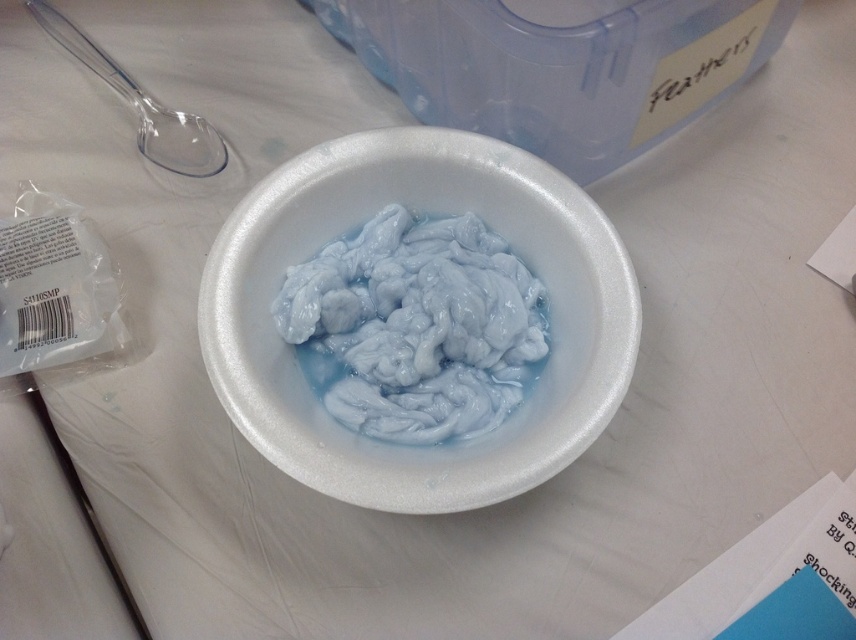
You are a scientist observing the white styrofoam bowl at center and the white rubbery substance at center. Which object is taller?

The white styrofoam bowl at center is much taller than the white rubbery substance at center.

You are a photographer standing at a distance of 1.2 meters from the camera position. You want to adjust your position so that you can see the point at coordinates point (376, 506) clearly. Should you move closer or farther away from the current camera position?

The point at coordinates point (376, 506) is currently 1.17 meters away from the camera. Since you are standing 1.2 meters away from the camera position, you should move closer to the camera by 0.03 meters to align with the point.

You are a scientist working in a lab and need to stir the contents of the white styrofoam bowl at center. The transparent plastic spoon at upper left is nearby. Can you reach the spoon without moving your current position?

The white styrofoam bowl at center is located below the transparent plastic spoon at upper left, so the spoon is above the bowl. If you are positioned near the bowl, you can likely reach upward to access the spoon without needing to move your position.